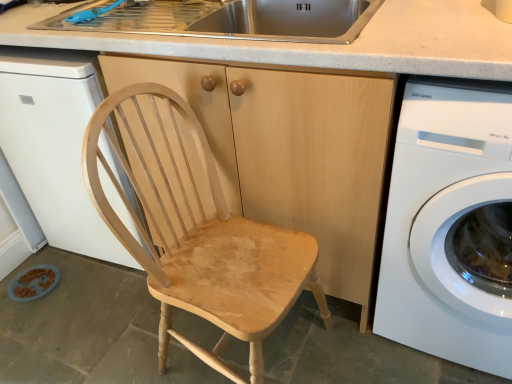
Question: Considering the relative sizes of blue plastic faucet at upper left and white glossy washing machine at right in the image provided, is blue plastic faucet at upper left bigger than white glossy washing machine at right?

Choices:
 (A) no
 (B) yes

Answer: (A)

Question: Considering the relative sizes of blue plastic faucet at upper left and white glossy washing machine at right in the image provided, is blue plastic faucet at upper left wider than white glossy washing machine at right?

Choices:
 (A) no
 (B) yes

Answer: (A)

Question: Considering the relative positions of blue plastic faucet at upper left and white glossy washing machine at right in the image provided, is blue plastic faucet at upper left to the left of white glossy washing machine at right from the viewer's perspective?

Choices:
 (A) yes
 (B) no

Answer: (A)

Question: From a real-world perspective, is blue plastic faucet at upper left positioned under white glossy washing machine at right based on gravity?

Choices:
 (A) no
 (B) yes

Answer: (A)

Question: Can you confirm if blue plastic faucet at upper left is shorter than white glossy washing machine at right?

Choices:
 (A) no
 (B) yes

Answer: (B)

Question: Is white glossy dishwasher at left in front of or behind white glossy washing machine at right in the image?

Choices:
 (A) behind
 (B) front

Answer: (A)

Question: Looking at their shapes, would you say white glossy dishwasher at left is wider or thinner than white glossy washing machine at right?

Choices:
 (A) thin
 (B) wide

Answer: (B)

Question: Looking at the image, does white glossy dishwasher at left seem bigger or smaller compared to white glossy washing machine at right?

Choices:
 (A) big
 (B) small

Answer: (A)

Question: From their relative heights in the image, would you say white glossy dishwasher at left is taller or shorter than white glossy washing machine at right?

Choices:
 (A) tall
 (B) short

Answer: (A)

Question: From the image's perspective, is light wood cabinet at center positioned above or below stainless steel sink at upper center?

Choices:
 (A) above
 (B) below

Answer: (B)

Question: Considering the positions of light wood cabinet at center and stainless steel sink at upper center in the image, is light wood cabinet at center taller or shorter than stainless steel sink at upper center?

Choices:
 (A) short
 (B) tall

Answer: (B)

Question: Is light wood cabinet at center situated inside stainless steel sink at upper center or outside?

Choices:
 (A) inside
 (B) outside

Answer: (B)

Question: Considering the positions of light wood cabinet at center and stainless steel sink at upper center in the image, is light wood cabinet at center bigger or smaller than stainless steel sink at upper center?

Choices:
 (A) small
 (B) big

Answer: (B)

Question: Visually, is blue plastic faucet at upper left positioned to the left or to the right of white glossy washing machine at right?

Choices:
 (A) right
 (B) left

Answer: (B)

Question: Considering the positions of point (91, 16) and point (499, 115), is point (91, 16) closer or farther from the camera than point (499, 115)?

Choices:
 (A) closer
 (B) farther

Answer: (B)